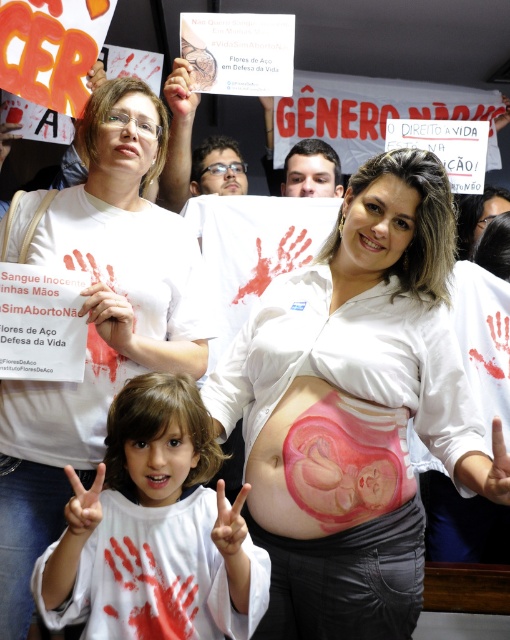
Question: Estimate the real-world distances between objects in this image. Which object is farther from the white matte shirt at center?

Choices:
 (A) white paper hand at lower left
 (B) pink matte/soft baby at center
 (C) pink glossy baby at center

Answer: (B)

Question: In this image, where is pink glossy baby at center located relative to white matte shirt at center?

Choices:
 (A) above
 (B) below

Answer: (B)

Question: Is white matte shirt at center in front of white paper hand at lower left?

Choices:
 (A) no
 (B) yes

Answer: (A)

Question: Estimate the real-world distances between objects in this image. Which object is farther from the white paper hand at lower left?

Choices:
 (A) white matte shirt at center
 (B) pink glossy baby at center
 (C) pink matte/soft baby at center

Answer: (A)

Question: Is white matte shirt at center in front of white paper hand at lower left?

Choices:
 (A) no
 (B) yes

Answer: (A)

Question: Which object appears farthest from the camera in this image?

Choices:
 (A) pink glossy baby at center
 (B) white paper hand at lower left

Answer: (B)